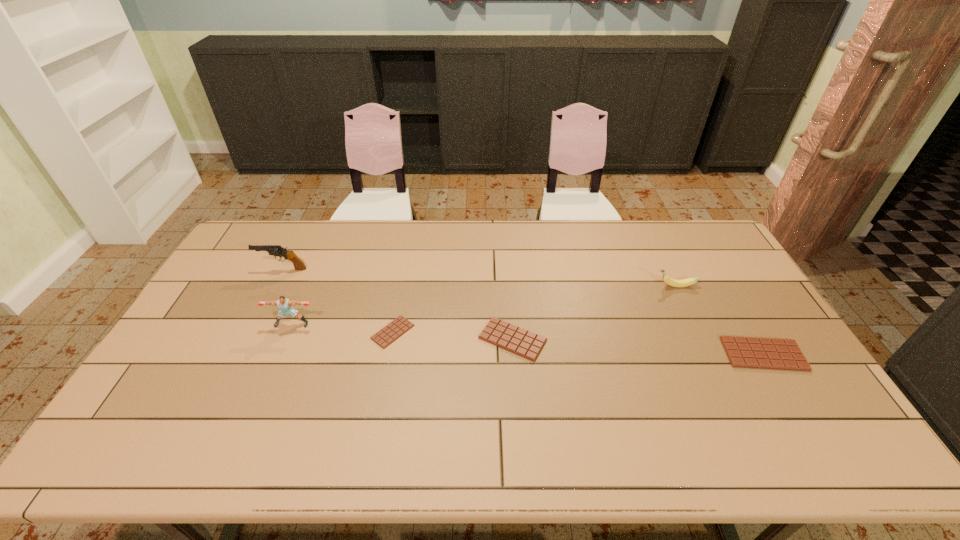
At what (x,y) coordinates should I click in order to perform the action: click on candy bar object that ranks as the second closest to the puncher. Please return your answer as a coordinate pair (x, y). Looking at the image, I should click on (524, 343).

This screenshot has height=540, width=960. I want to click on free region that satisfies the following two spatial constraints: 1. at the stem of the rightmost candy bar; 2. on the right side of the banana, so click(x=708, y=354).

The height and width of the screenshot is (540, 960). In order to click on vacant space that satisfies the following two spatial constraints: 1. on the front-facing side of the shortest candy bar; 2. on the left side of the puncher in this screenshot , I will do `click(289, 332)`.

I want to click on free spot that satisfies the following two spatial constraints: 1. on the front-facing side of the third object from right to left; 2. on the right side of the puncher, so click(x=286, y=339).

Image resolution: width=960 pixels, height=540 pixels. I want to click on vacant space that satisfies the following two spatial constraints: 1. on the front-facing side of the puncher; 2. on the left side of the rightmost candy bar, so click(279, 354).

Locate an element on the screen. The height and width of the screenshot is (540, 960). free point that satisfies the following two spatial constraints: 1. at the stem of the fifth nearest object; 2. on the right side of the rightmost candy bar is located at coordinates (708, 354).

Where is `vacant area that satisfies the following two spatial constraints: 1. on the front side of the rightmost candy bar; 2. on the left side of the second candy bar from right to left`? Image resolution: width=960 pixels, height=540 pixels. vacant area that satisfies the following two spatial constraints: 1. on the front side of the rightmost candy bar; 2. on the left side of the second candy bar from right to left is located at coordinates (514, 354).

Locate an element on the screen. This screenshot has width=960, height=540. vacant space that satisfies the following two spatial constraints: 1. on the front-facing side of the puncher; 2. on the right side of the rightmost candy bar is located at coordinates (279, 354).